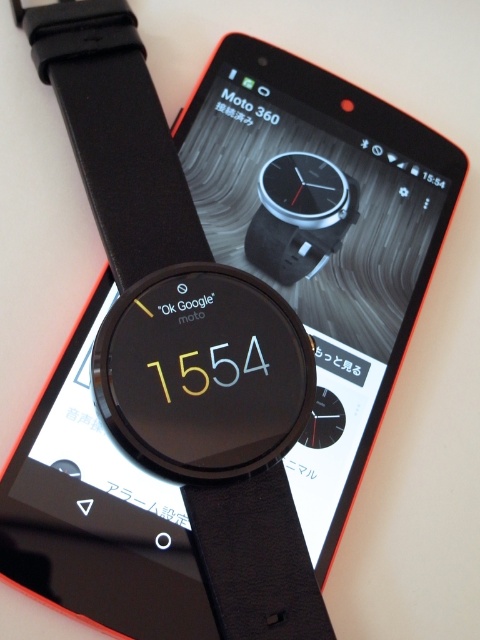
Question: Among these objects, which one is nearest to the camera?

Choices:
 (A) black matte watch at center
 (B) black leather strap at center

Answer: (B)

Question: Is black leather strap at center in front of black matte watch at center?

Choices:
 (A) yes
 (B) no

Answer: (A)

Question: Can you confirm if black leather strap at center is positioned to the right of black matte watch at center?

Choices:
 (A) yes
 (B) no

Answer: (B)

Question: Among these objects, which one is farthest from the camera?

Choices:
 (A) black leather strap at center
 (B) black matte watch at center

Answer: (B)

Question: Where is black leather strap at center located in relation to black matte watch at center in the image?

Choices:
 (A) left
 (B) right

Answer: (A)